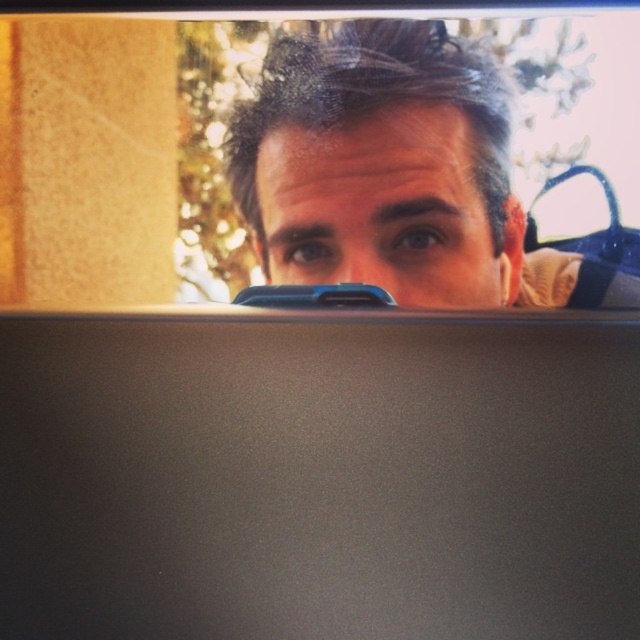
You are a photographer setting up a portrait session. You notice the matte black view mirror at upper center and the matte black hair at upper center in the frame. Which object is closer to the top edge of the image?

The matte black view mirror at upper center is positioned over the matte black hair at upper center, meaning it is closer to the top edge of the image.

You are a photographer trying to capture a clear shot of the person in the scene. You notice the matte black view mirror at upper center and the matte black hair at upper center. Which object is positioned closer to you, the photographer?

The matte black view mirror at upper center is closer to the viewer than the matte black hair at upper center, so the photographer should adjust their angle to avoid reflection from the mirror.

You are a delivery person who needs to attach a package to the matte black view mirror at upper center. The package is 12 inches long. Can you fit it on the mirror without exceeding the distance limit?

The distance of matte black view mirror at upper center from viewer is 30.57 inches. Since the package is 12 inches long, it can be attached as the distance available is more than the package length.